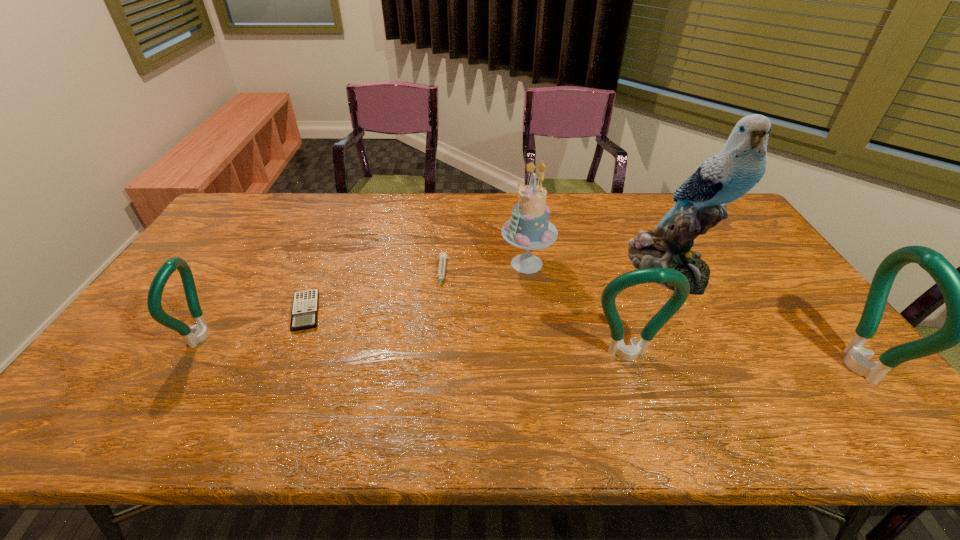
At what (x,y) coordinates should I click in order to perform the action: click on free space located with a ladder on the side of the fourth object from right to left. Please return your answer as a coordinate pair (x, y). The width and height of the screenshot is (960, 540). Looking at the image, I should click on (430, 264).

This screenshot has width=960, height=540. In order to click on free space located with a ladder on the side of the fourth object from right to left in this screenshot , I will do `click(423, 264)`.

This screenshot has height=540, width=960. Identify the location of object that is at the right edge. (959, 291).

Locate an element on the screen. The width and height of the screenshot is (960, 540). object positioned at the near right corner is located at coordinates (959, 291).

At what (x,y) coordinates should I click in order to perform the action: click on vacant space at the far edge. Please return your answer as a coordinate pair (x, y). This screenshot has width=960, height=540. Looking at the image, I should click on (387, 217).

Identify the location of vacant space at the near edge of the desktop. (369, 381).

In the image, there is a desktop. What are the coordinates of `vacant space at the left edge` in the screenshot? It's located at (182, 340).

In the image, there is a desktop. Identify the location of vacant space at the far left corner. (274, 204).

In the image, there is a desktop. At what (x,y) coordinates should I click in order to perform the action: click on vacant region at the near left corner. Please return your answer as a coordinate pair (x, y). The image size is (960, 540). Looking at the image, I should click on (103, 391).

Image resolution: width=960 pixels, height=540 pixels. In order to click on free space between the leftmost bottle opener and the fourth object from left to right in this screenshot , I will do `click(365, 300)`.